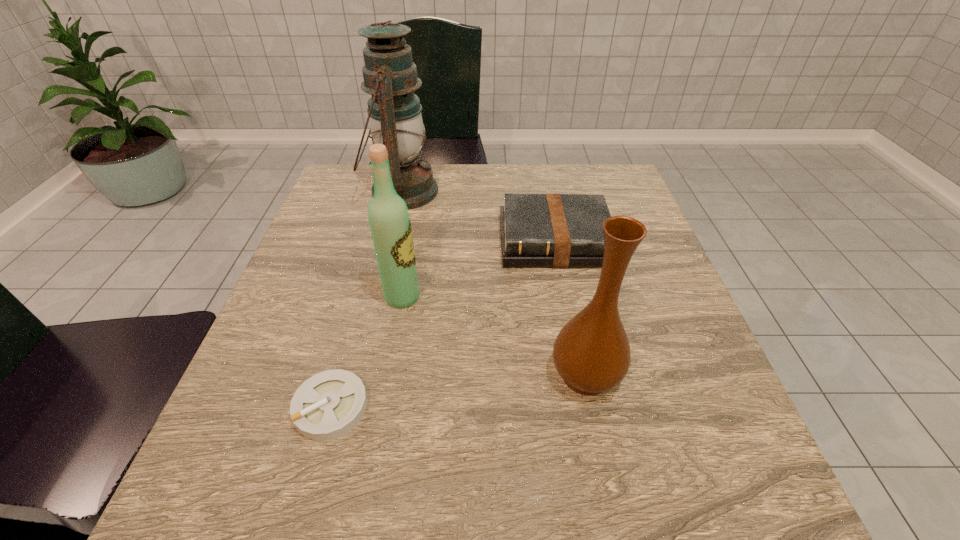
Locate an element on the screen. The image size is (960, 540). object located in the far edge section of the desktop is located at coordinates (394, 112).

Find the location of `oil lamp positioned at the left edge`. oil lamp positioned at the left edge is located at coordinates (394, 112).

This screenshot has width=960, height=540. What are the coordinates of `ashtray present at the left edge` in the screenshot? It's located at (328, 405).

The height and width of the screenshot is (540, 960). Identify the location of vase that is positioned at the right edge. (591, 353).

Find the location of a particular element. hardback book situated at the right edge is located at coordinates (537, 230).

Identify the location of object positioned at the far left corner. (394, 112).

You are a GUI agent. You are given a task and a screenshot of the screen. Output one action in this format:
    pyautogui.click(x=<x>, y=<y>)
    Task: Click on the free space at the far edge
    The image size is (960, 540).
    Given the screenshot: What is the action you would take?
    pyautogui.click(x=542, y=183)

Find the location of a particular element. The height and width of the screenshot is (540, 960). vacant region at the near edge is located at coordinates (445, 467).

Where is `vacant region at the left edge of the desktop`? The image size is (960, 540). vacant region at the left edge of the desktop is located at coordinates (333, 268).

This screenshot has width=960, height=540. I want to click on vacant space at the right edge of the desktop, so click(641, 310).